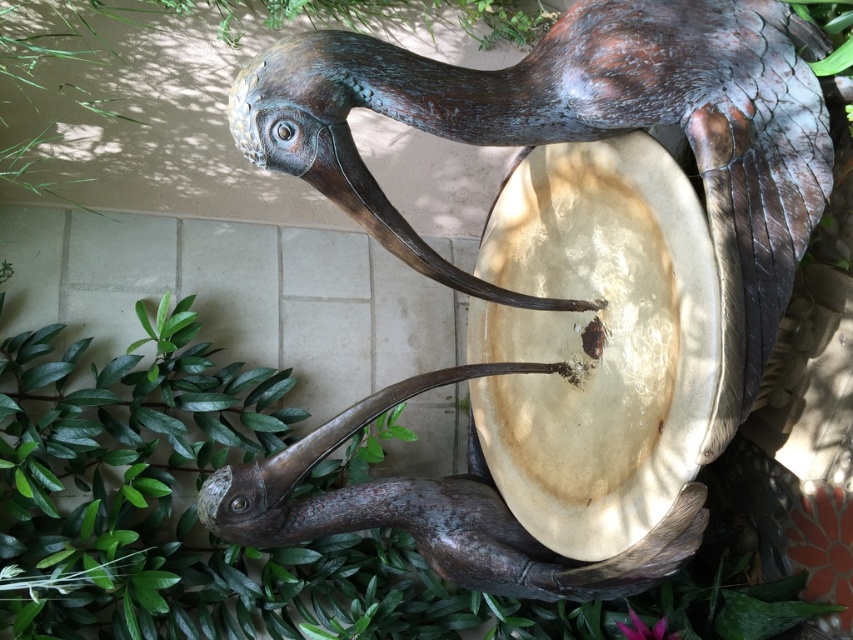
Question: Can you confirm if bronze textured bird at center is positioned below green leafy plant at lower left?

Choices:
 (A) no
 (B) yes

Answer: (A)

Question: Which object appears closest to the camera in this image?

Choices:
 (A) green leafy plant at lower left
 (B) bronze textured bird at center

Answer: (B)

Question: Is bronze textured bird at center bigger than green leafy plant at lower left?

Choices:
 (A) yes
 (B) no

Answer: (B)

Question: Can you confirm if bronze textured bird at center is wider than green leafy plant at lower left?

Choices:
 (A) no
 (B) yes

Answer: (A)